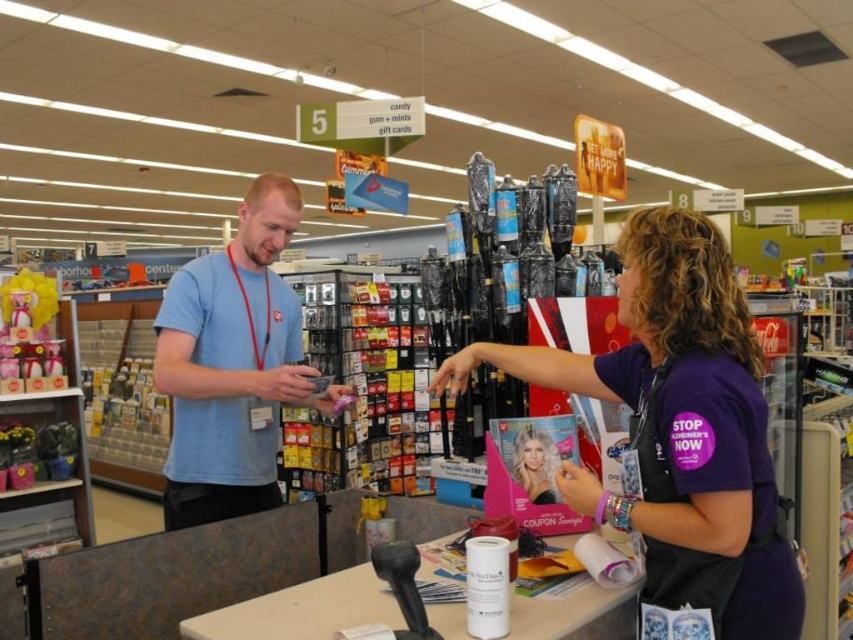
Question: In this image, where is purple fabric shirt at center located relative to light blue t-shirt at center?

Choices:
 (A) above
 (B) below

Answer: (B)

Question: Can you confirm if purple fabric shirt at center is positioned to the left of light blue t-shirt at center?

Choices:
 (A) yes
 (B) no

Answer: (B)

Question: Can you confirm if purple fabric shirt at center is positioned to the left of light blue t-shirt at center?

Choices:
 (A) no
 (B) yes

Answer: (A)

Question: Which point is farther to the camera?

Choices:
 (A) (202, 330)
 (B) (682, 220)

Answer: (A)